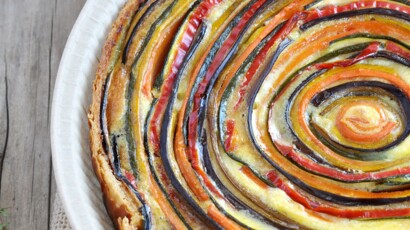
Find the location of a particular element. This screenshot has height=230, width=410. left side of white bowl is located at coordinates (64, 123).